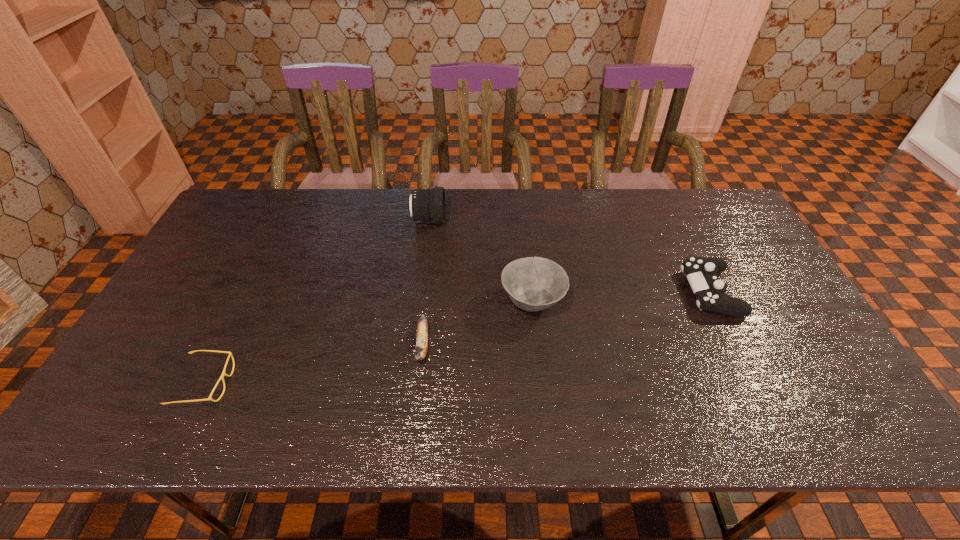
This screenshot has width=960, height=540. Find the location of `the farthest object`. the farthest object is located at coordinates (428, 205).

Find the location of `the tallest object`. the tallest object is located at coordinates (428, 205).

Find the location of a particular element. This screenshot has width=960, height=540. the fourth object from left to right is located at coordinates (533, 283).

The width and height of the screenshot is (960, 540). I want to click on the fourth shortest object, so click(533, 283).

Find the location of a particular element. The image size is (960, 540). banana is located at coordinates (422, 329).

Locate an element on the screen. This screenshot has width=960, height=540. control is located at coordinates (701, 272).

I want to click on the shortest object, so click(x=230, y=354).

Where is `spectacles`? The image size is (960, 540). spectacles is located at coordinates click(230, 354).

Find the location of a particular element. The height and width of the screenshot is (540, 960). vacant space situated at the front element of the telephoto lens is located at coordinates (472, 220).

Locate an element on the screen. Image resolution: width=960 pixels, height=540 pixels. vacant space located on the left of the second object from right to left is located at coordinates (392, 301).